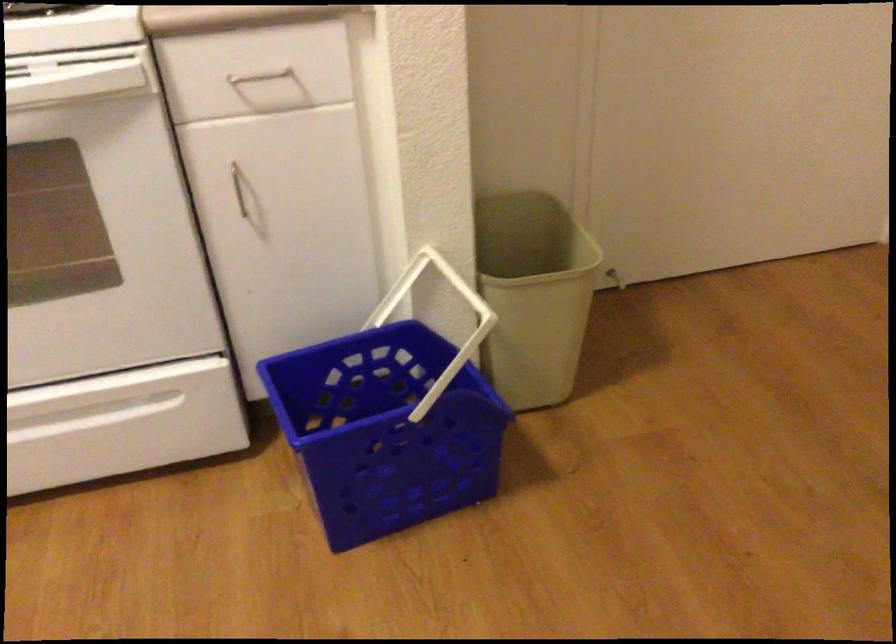
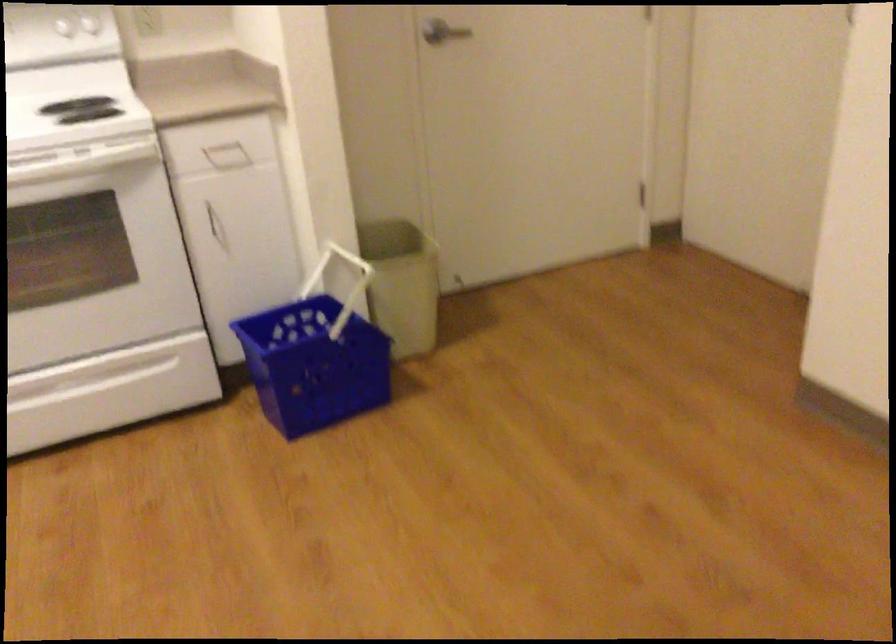
Find the pixel in the second image that matches (434,292) in the first image.

(337, 272)